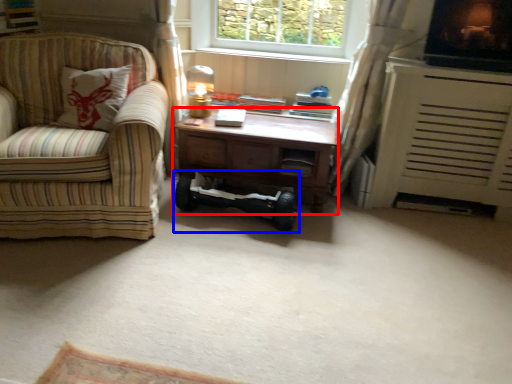
Question: Which object is further to the camera taking this photo, desk (highlighted by a red box) or mobility scooter (highlighted by a blue box)?

Choices:
 (A) desk
 (B) mobility scooter

Answer: (A)